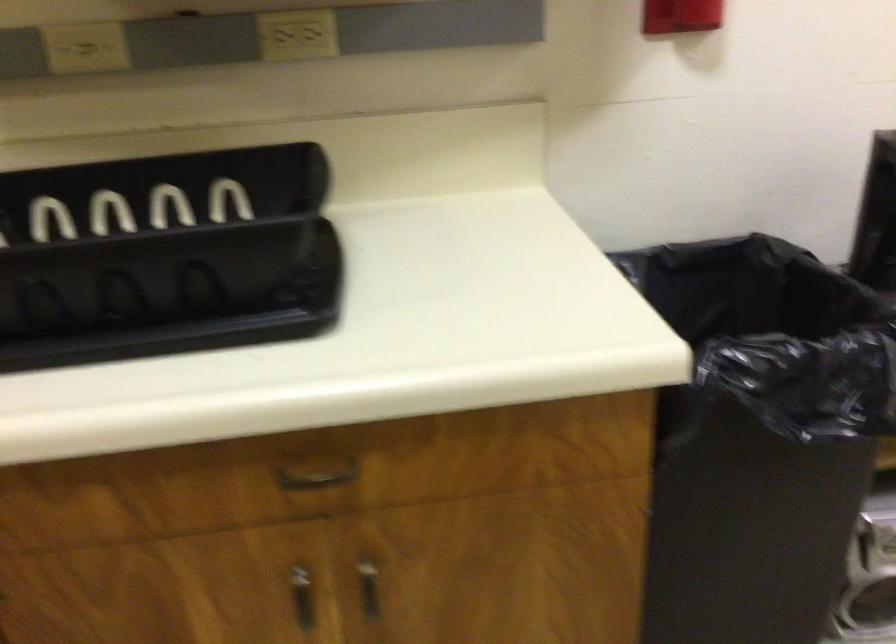
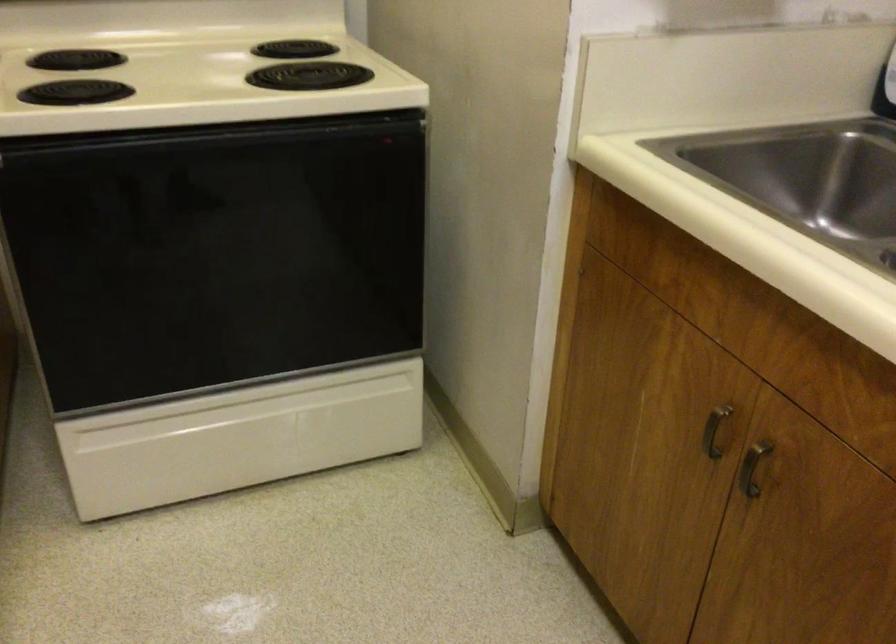
Based on the continuous images, in which direction is the camera rotating?

The camera's rotation is toward left-down.